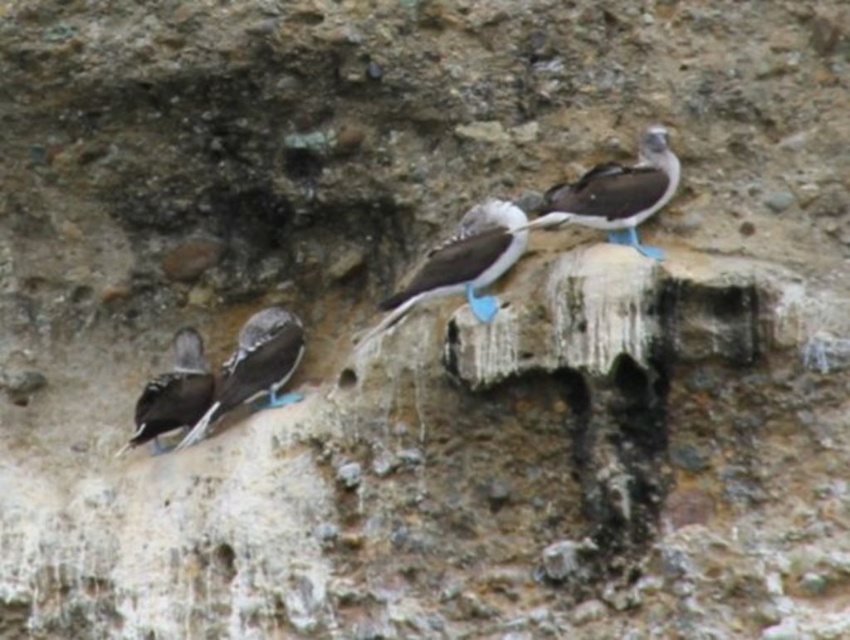
Is white feathered bird at center closer to camera compared to blue feathered bird at center?

No, white feathered bird at center is behind blue feathered bird at center.

Is point (629, 236) positioned after point (431, 248)?

That is False.

This screenshot has width=850, height=640. What are the coordinates of `white feathered bird at center` in the screenshot? It's located at (616, 195).

Does blue feathered bird at center appear under matte black bird at left?

Incorrect, blue feathered bird at center is not positioned below matte black bird at left.

Who is more forward, [507,253] or [171,419]?

Point [507,253]

Where is `blue feathered bird at center`? The image size is (850, 640). blue feathered bird at center is located at coordinates (462, 262).

Is point (251, 358) positioned before point (190, 356)?

That is True.

What do you see at coordinates (255, 368) in the screenshot? This screenshot has height=640, width=850. I see `shiny black feathers at left` at bounding box center [255, 368].

I want to click on shiny black feathers at left, so click(x=255, y=368).